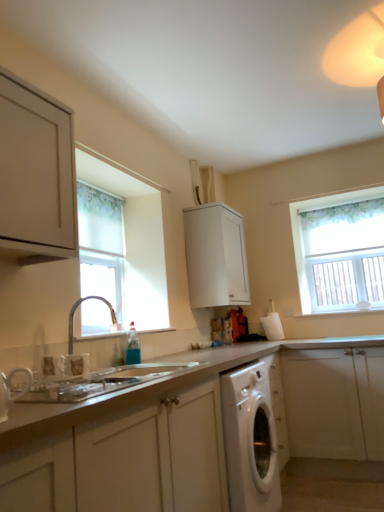
The height and width of the screenshot is (512, 384). In order to click on white matte cabinet at lower right, positioned as the 2th cabinetry in back-to-front order in this screenshot , I will do `click(334, 402)`.

What is the approximate width of white fabric window at left, the 1th window positioned from the front?

The width of white fabric window at left, the 1th window positioned from the front, is 4.64 inches.

Locate an element on the screen. white matte cabinet at lower center, placed as the first cabinetry when sorted from front to back is located at coordinates (127, 461).

This screenshot has width=384, height=512. What do you see at coordinates (127, 461) in the screenshot?
I see `white matte cabinet at lower center, the fourth cabinetry when ordered from back to front` at bounding box center [127, 461].

Describe the element at coordinates (340, 250) in the screenshot. I see `white textured window at upper right, which is counted as the second window, starting from the left` at that location.

How much space does white textured window at upper right, which is counted as the second window, starting from the left, occupy horizontally?

The width of white textured window at upper right, which is counted as the second window, starting from the left, is 4.81 inches.

I want to click on white matte cabinet at lower right, the 3th cabinetry when ordered from front to back, so click(334, 402).

Is white fabric window at left, which is the 1th window from left to right, facing away from white matte cabinet at lower center, the fourth cabinetry when ordered from back to front?

No, white fabric window at left, which is the 1th window from left to right,'s orientation is not away from white matte cabinet at lower center, the fourth cabinetry when ordered from back to front.

Consider the image. Can you tell me how much white fabric window at left, the 1th window positioned from the front, and white matte cabinet at lower center, placed as the first cabinetry when sorted from front to back, differ in facing direction?

They differ by 0.224 degrees in their facing directions.

Considering the relative sizes of white fabric window at left, the 2th window viewed from the back, and white matte cabinet at lower center, the fourth cabinetry when ordered from back to front, in the image provided, is white fabric window at left, the 2th window viewed from the back, taller than white matte cabinet at lower center, the fourth cabinetry when ordered from back to front,?

Yes, white fabric window at left, the 2th window viewed from the back, is taller than white matte cabinet at lower center, the fourth cabinetry when ordered from back to front.

Can you confirm if white matte cabinet at lower center, the fourth cabinetry when ordered from back to front, is smaller than white glossy washing machine at lower center?

No, white matte cabinet at lower center, the fourth cabinetry when ordered from back to front, is not smaller than white glossy washing machine at lower center.

Can you tell me how much white matte cabinet at lower center, placed as the first cabinetry when sorted from front to back, and white glossy washing machine at lower center differ in facing direction?

The facing directions of white matte cabinet at lower center, placed as the first cabinetry when sorted from front to back, and white glossy washing machine at lower center are 0.0038 degrees apart.

From the image's perspective, is white matte cabinet at lower center, placed as the first cabinetry when sorted from front to back, under white glossy washing machine at lower center?

No, from the image's perspective, white matte cabinet at lower center, placed as the first cabinetry when sorted from front to back, is not below white glossy washing machine at lower center.

Does white matte cabinet at lower center, placed as the first cabinetry when sorted from front to back, have a lesser height compared to white glossy washing machine at lower center?

Yes.

From a real-world perspective, between matte white cabinet at upper left, the 2th cabinetry when ordered from front to back, and white glossy washing machine at lower center, who is vertically lower?

white glossy washing machine at lower center, from a real-world perspective.

Is matte white cabinet at upper left, which appears as the third cabinetry when viewed from the back, next to white glossy washing machine at lower center?

matte white cabinet at upper left, which appears as the third cabinetry when viewed from the back, is not next to white glossy washing machine at lower center, and they're not touching.

Considering the relative positions of matte white cabinet at upper left, which appears as the third cabinetry when viewed from the back, and white glossy washing machine at lower center in the image provided, is matte white cabinet at upper left, which appears as the third cabinetry when viewed from the back, to the left or to the right of white glossy washing machine at lower center?

In the image, matte white cabinet at upper left, which appears as the third cabinetry when viewed from the back, appears on the left side of white glossy washing machine at lower center.

Can you confirm if white matte cabinet at lower right, positioned as the 2th cabinetry in back-to-front order, is wider than white textured window at upper right, the first window in the right-to-left sequence?

Yes.

Who is bigger, white matte cabinet at lower right, positioned as the 2th cabinetry in back-to-front order, or white textured window at upper right, which is counted as the second window, starting from the left?

Bigger between the two is white matte cabinet at lower right, positioned as the 2th cabinetry in back-to-front order.

From the image's perspective, is white matte cabinet at lower right, positioned as the 2th cabinetry in back-to-front order, on top of white textured window at upper right, which is counted as the second window, starting from the left?

No.

From a real-world perspective, is white matte cabinet at lower right, positioned as the 2th cabinetry in back-to-front order, below white textured window at upper right, which is counted as the second window, starting from the left?

Correct, in the physical world, white matte cabinet at lower right, positioned as the 2th cabinetry in back-to-front order, is lower than white textured window at upper right, which is counted as the second window, starting from the left.

Which of these two, matte white cabinet at upper left, the 2th cabinetry when ordered from front to back, or white matte cabinet at lower center, placed as the first cabinetry when sorted from front to back, is wider?

white matte cabinet at lower center, placed as the first cabinetry when sorted from front to back.

Identify the location of cabinetry that is the 1st object located behind the white matte cabinet at lower center, placed as the first cabinetry when sorted from front to back. The width and height of the screenshot is (384, 512). (36, 175).

Is matte white cabinet at upper left, which appears as the third cabinetry when viewed from the back, further to camera compared to white matte cabinet at lower center, the fourth cabinetry when ordered from back to front?

Yes, it is behind white matte cabinet at lower center, the fourth cabinetry when ordered from back to front.

Which is more to the right, matte white cabinet at upper left, which appears as the third cabinetry when viewed from the back, or white fabric window at left, the 2th window viewed from the back?

From the viewer's perspective, white fabric window at left, the 2th window viewed from the back, appears more on the right side.

Is matte white cabinet at upper left, which appears as the third cabinetry when viewed from the back, inside the boundaries of white fabric window at left, the 2th window viewed from the back, or outside?

matte white cabinet at upper left, which appears as the third cabinetry when viewed from the back, is not inside white fabric window at left, the 2th window viewed from the back, it's outside.

Between matte white cabinet at upper left, the 2th cabinetry when ordered from front to back, and white fabric window at left, which is the 1th window from left to right, which one is positioned in front?

matte white cabinet at upper left, the 2th cabinetry when ordered from front to back, is more forward.

From the picture: From a real-world perspective, is matte white cabinet at upper left, which appears as the third cabinetry when viewed from the back, above or below white fabric window at left, which is counted as the second window, starting from the right?

matte white cabinet at upper left, which appears as the third cabinetry when viewed from the back, is situated higher than white fabric window at left, which is counted as the second window, starting from the right, in the real world.

In the scene shown: Based on their sizes in the image, would you say silver metallic tap at lower left is bigger or smaller than white matte cabinet at lower center, the fourth cabinetry when ordered from back to front?

Clearly, silver metallic tap at lower left is smaller in size than white matte cabinet at lower center, the fourth cabinetry when ordered from back to front.

Choose the correct answer: Is silver metallic tap at lower left inside white matte cabinet at lower center, placed as the first cabinetry when sorted from front to back, or outside it?

silver metallic tap at lower left is outside white matte cabinet at lower center, placed as the first cabinetry when sorted from front to back.

Is silver metallic tap at lower left positioned far away from white matte cabinet at lower center, placed as the first cabinetry when sorted from front to back?

That's right, there is a large distance between silver metallic tap at lower left and white matte cabinet at lower center, placed as the first cabinetry when sorted from front to back.

In the image, is silver metallic tap at lower left positioned in front of or behind white matte cabinet at lower center, placed as the first cabinetry when sorted from front to back?

Clearly, silver metallic tap at lower left is behind white matte cabinet at lower center, placed as the first cabinetry when sorted from front to back.

Locate an element on the screen. Image resolution: width=384 pixels, height=512 pixels. the 2nd cabinetry in front of the white fabric window at left, which is counted as the second window, starting from the right is located at coordinates (127, 461).

Locate an element on the screen. The height and width of the screenshot is (512, 384). washing machine that appears on the right of white matte cabinet at lower center, the fourth cabinetry when ordered from back to front is located at coordinates (250, 440).

When comparing their distances from white fabric window at left, the 2th window viewed from the back, does white textured window at upper right, the second window viewed from the front, or white matte cabinet at center, which is the first cabinetry from back to front, seem closer?

The object closer to white fabric window at left, the 2th window viewed from the back, is white matte cabinet at center, which is the first cabinetry from back to front.

In the scene shown: From the image, which object appears to be nearer to white matte cabinet at center, which is the first cabinetry from back to front, silver metallic tap at lower left or white matte cabinet at lower center, the fourth cabinetry when ordered from back to front?

silver metallic tap at lower left.

Looking at the image, which one is located further to matte white cabinet at upper left, which appears as the third cabinetry when viewed from the back, white glossy washing machine at lower center or white matte cabinet at lower right, positioned as the 2th cabinetry in back-to-front order?

white matte cabinet at lower right, positioned as the 2th cabinetry in back-to-front order, is further to matte white cabinet at upper left, which appears as the third cabinetry when viewed from the back.

From the image, which object appears to be nearer to white matte cabinet at lower center, the fourth cabinetry when ordered from back to front, white glossy washing machine at lower center or silver metallic tap at lower left?

white glossy washing machine at lower center.

Estimate the real-world distances between objects in this image. Which object is closer to silver metallic tap at lower left, white textured window at upper right, which is counted as the second window, starting from the left, or white matte cabinet at lower center, the fourth cabinetry when ordered from back to front?

white matte cabinet at lower center, the fourth cabinetry when ordered from back to front, lies closer to silver metallic tap at lower left than the other object.

Which object lies nearer to the anchor point white matte cabinet at center, which is the first cabinetry from back to front, white matte cabinet at lower center, placed as the first cabinetry when sorted from front to back, or white textured window at upper right, the first window in the right-to-left sequence?

The object closer to white matte cabinet at center, which is the first cabinetry from back to front, is white textured window at upper right, the first window in the right-to-left sequence.

Looking at this image, from the image, which object appears to be nearer to white textured window at upper right, the 1th window from the back, white matte cabinet at lower center, the fourth cabinetry when ordered from back to front, or white fabric window at left, the 1th window positioned from the front?

The object closer to white textured window at upper right, the 1th window from the back, is white fabric window at left, the 1th window positioned from the front.

Estimate the real-world distances between objects in this image. Which object is closer to silver metallic tap at lower left, white glossy washing machine at lower center or matte white cabinet at upper left, which appears as the third cabinetry when viewed from the back?

matte white cabinet at upper left, which appears as the third cabinetry when viewed from the back, is closer to silver metallic tap at lower left.

Where is `cabinetry positioned between white matte cabinet at lower center, placed as the first cabinetry when sorted from front to back, and white fabric window at left, the 2th window viewed from the back, from near to far`? The height and width of the screenshot is (512, 384). cabinetry positioned between white matte cabinet at lower center, placed as the first cabinetry when sorted from front to back, and white fabric window at left, the 2th window viewed from the back, from near to far is located at coordinates (36, 175).

Locate an element on the screen. tap that lies between white fabric window at left, the 2th window viewed from the back, and white glossy washing machine at lower center from top to bottom is located at coordinates (74, 312).

The width and height of the screenshot is (384, 512). Identify the location of washing machine between silver metallic tap at lower left and white matte cabinet at center, the fourth cabinetry positioned from the front, in the front-back direction. (250, 440).

Identify the location of window between matte white cabinet at upper left, the 2th cabinetry when ordered from front to back, and white matte cabinet at center, which is the first cabinetry from back to front, from front to back. (101, 245).